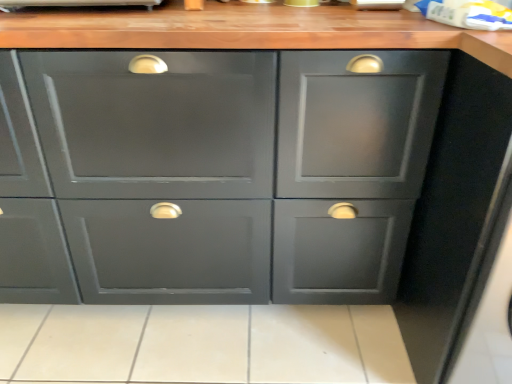
The width and height of the screenshot is (512, 384). Identify the location of vacant point above beige tile at lower center (from a real-world perspective). (193, 331).